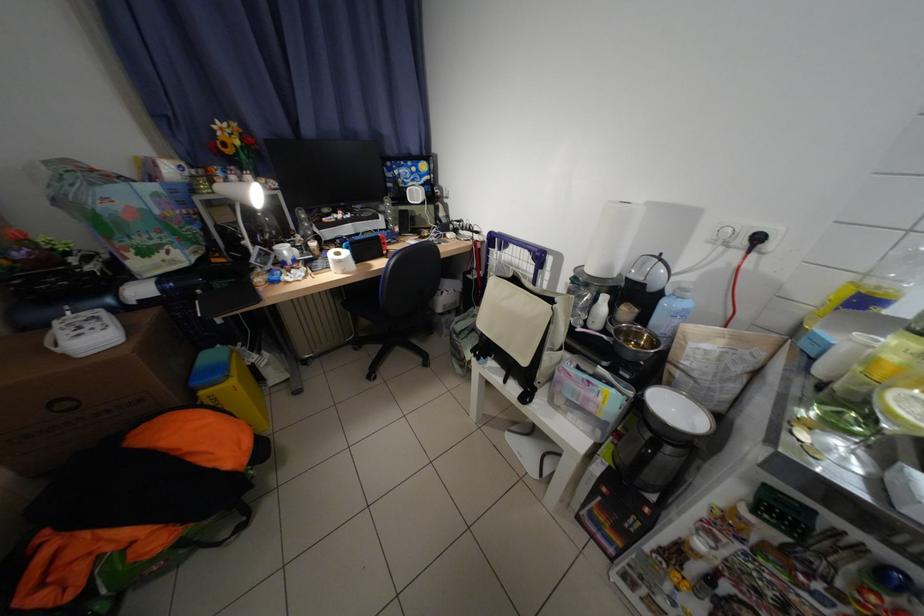
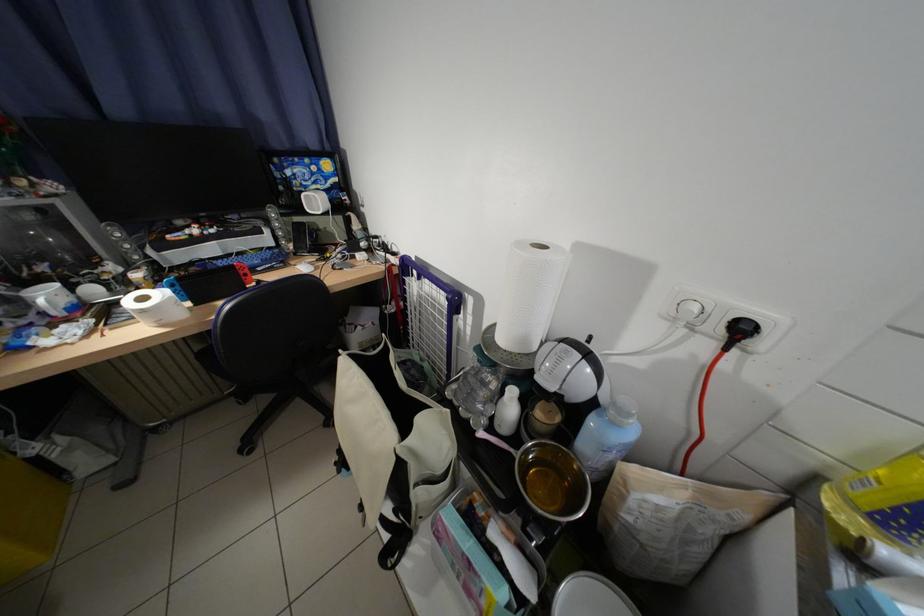
Question: The camera is either moving clockwise (left) or counter-clockwise (right) around the object. The first image is from the beginning of the video and the second image is from the end. Is the camera moving left or right when shooting the video?

Choices:
 (A) Left
 (B) Right

Answer: (A)